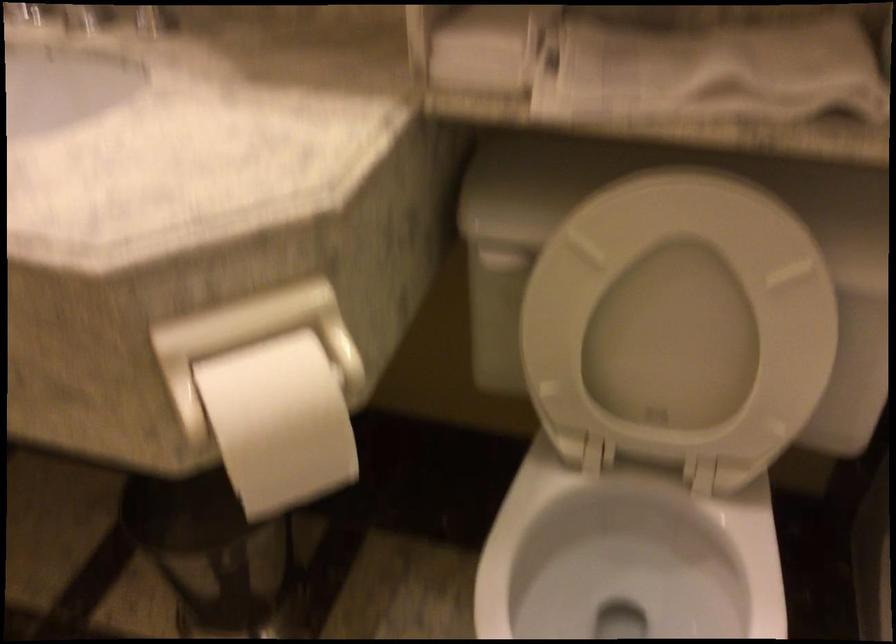
The location [279,422] corresponds to which object?

This point indicates the white toilet paper.